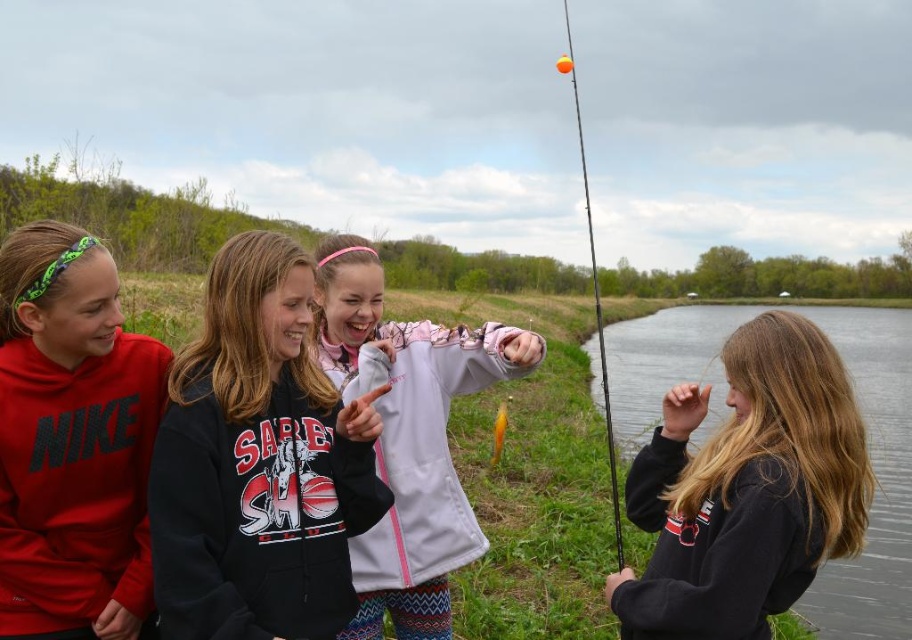
You are a photographer trying to capture a photo of the orange glossy fishing pole at upper right without including the matte red hoodie at left in the frame. Is this possible given their positions?

The matte red hoodie at left is located below the orange glossy fishing pole at upper right, so if you position yourself to focus on the upper right area while avoiding the lower section where the matte red hoodie at left is placed, you can capture the orange glossy fishing pole at upper right without including the matte red hoodie at left.

What is the 2D coordinate of the black fleece sweatshirt at center?

The black fleece sweatshirt at center is located at the 2D coordinate point of (x=258, y=464).

Based on the scene description, which clothing item is positioned higher on the girl wearing it? The black fleece sweatshirt at center or the white fleece jacket at center?

The black fleece sweatshirt at center is positioned higher than the white fleece jacket at center.